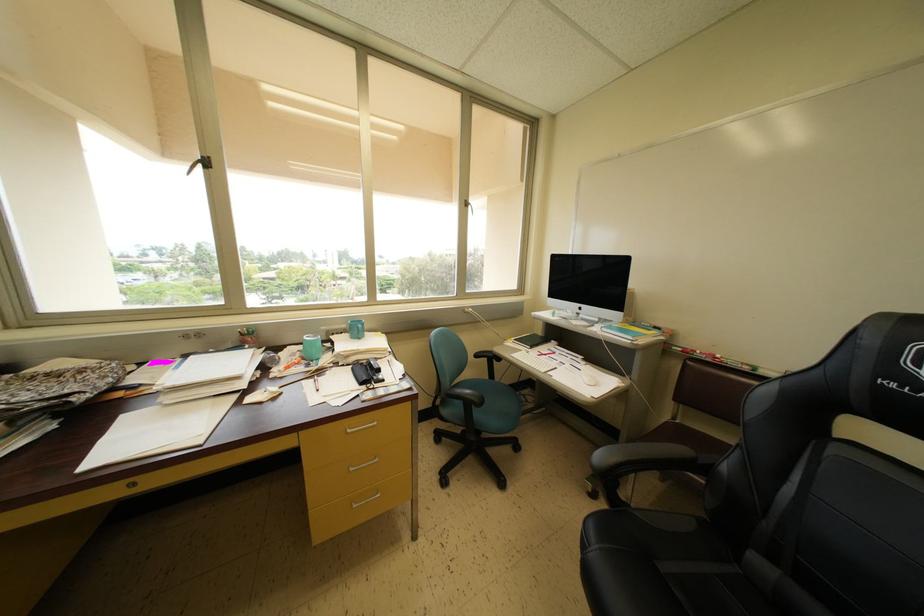
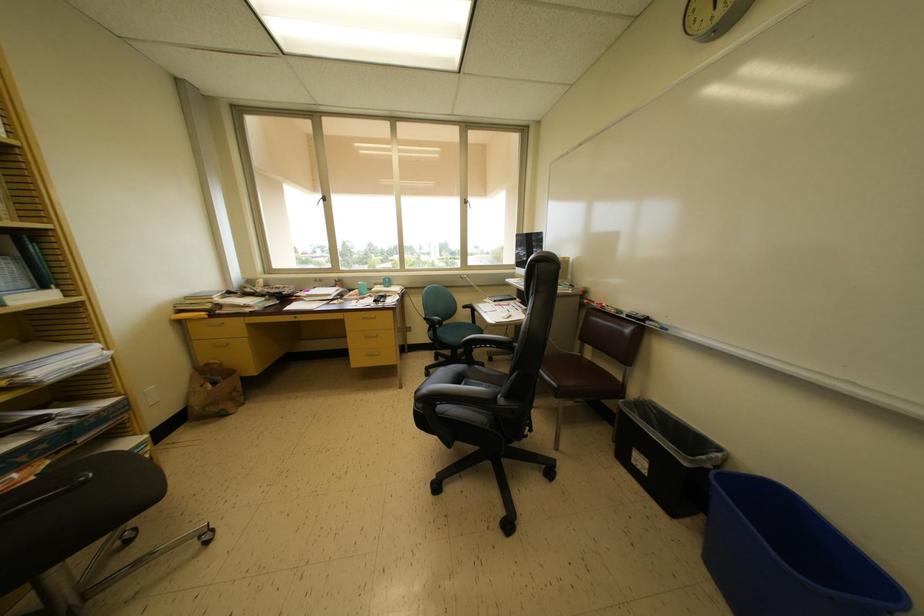
Which direction would the cameraman need to move to produce the second image?

The cameraman moved toward right, backward.